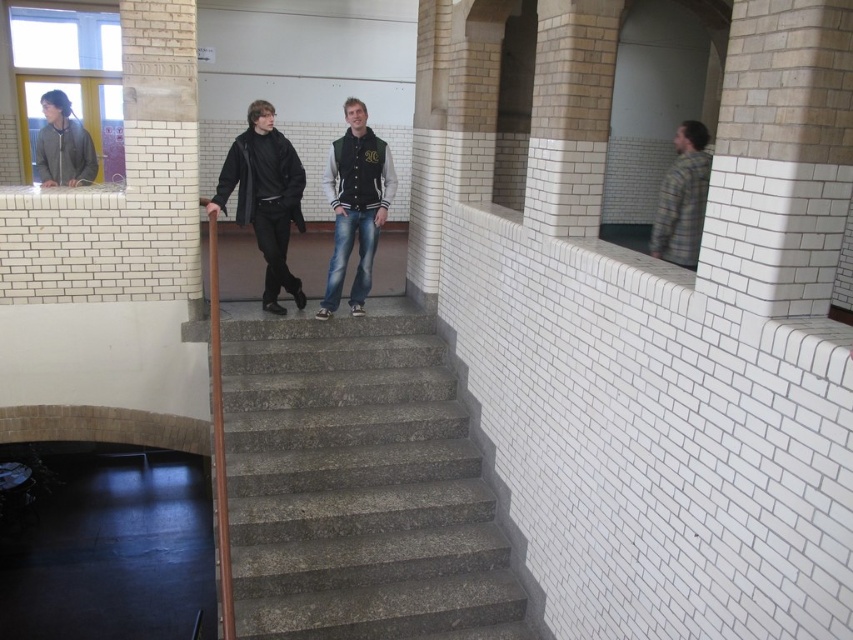
Question: Estimate the real-world distances between objects in this image. Which object is farther from the black matte jacket at center?

Choices:
 (A) plaid fabric shirt at right
 (B) varsity jacket at center
 (C) matte gray jacket at upper left
 (D) gray concrete stairs at center

Answer: (A)

Question: Considering the real-world distances, which object is closest to the plaid fabric shirt at right?

Choices:
 (A) black matte jacket at center
 (B) matte gray jacket at upper left
 (C) gray concrete stairs at center

Answer: (A)

Question: Does black matte jacket at center come behind plaid fabric shirt at right?

Choices:
 (A) yes
 (B) no

Answer: (B)

Question: Is varsity jacket at center to the right of plaid fabric shirt at right from the viewer's perspective?

Choices:
 (A) yes
 (B) no

Answer: (B)

Question: Is gray concrete stairs at center wider than varsity jacket at center?

Choices:
 (A) no
 (B) yes

Answer: (B)

Question: Among these objects, which one is farthest from the camera?

Choices:
 (A) matte gray jacket at upper left
 (B) varsity jacket at center
 (C) black matte jacket at center
 (D) gray concrete stairs at center

Answer: (A)